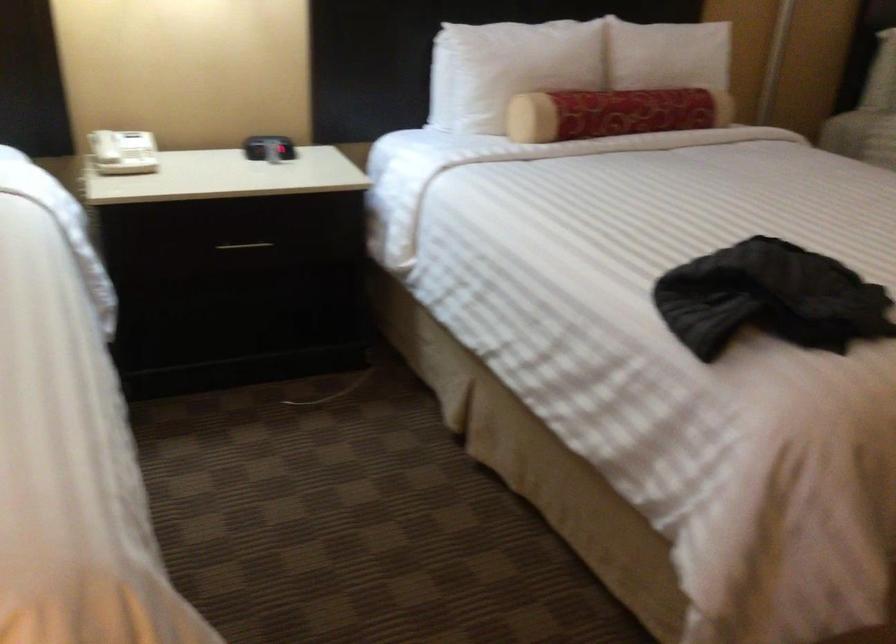
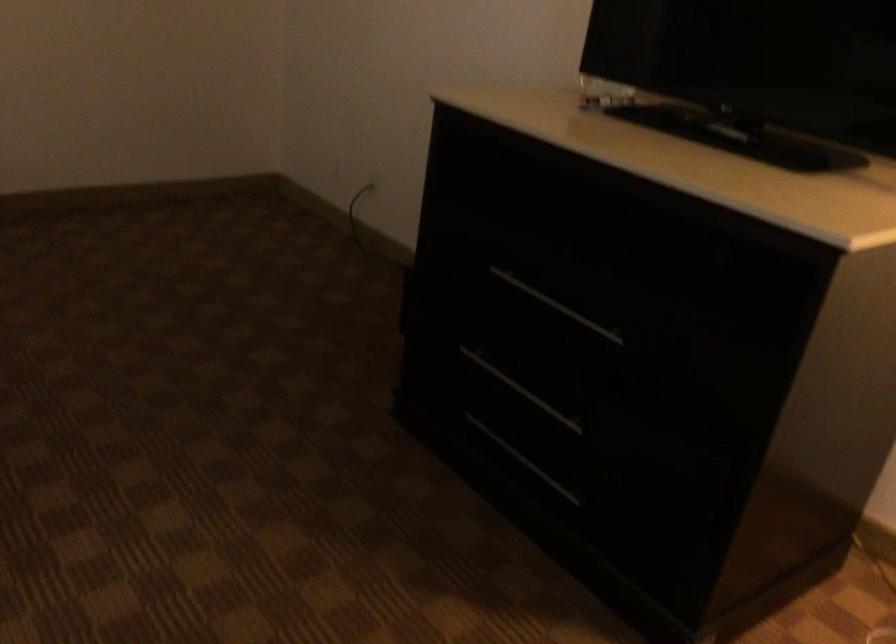
The images are taken continuously from a first-person perspective. In which direction is your viewpoint rotating?

The camera rotated toward right-down.